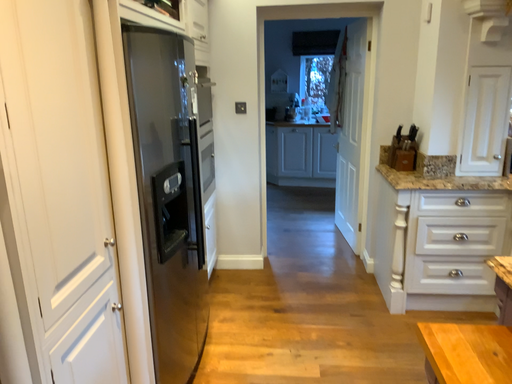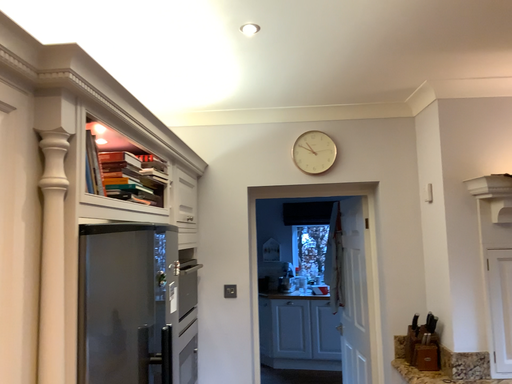
Question: How did the camera likely rotate when shooting the video?

Choices:
 (A) rotated upward
 (B) rotated downward

Answer: (A)